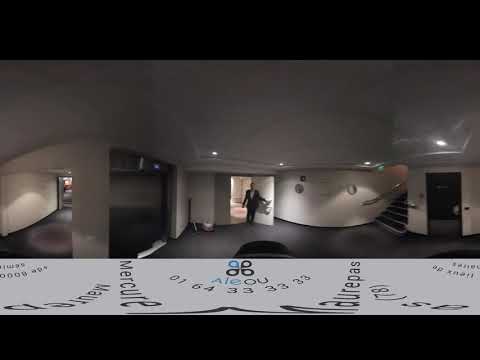
Locate an element on the screen. This screenshot has width=480, height=360. cieling light is located at coordinates (441, 142), (365, 164), (280, 164), (213, 152), (67, 171).